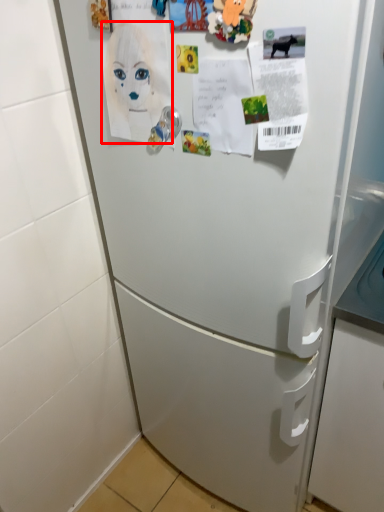
Question: From the image's perspective, what is the correct spatial positioning of woman (annotated by the red box) in reference to door handle?

Choices:
 (A) below
 (B) above

Answer: (B)